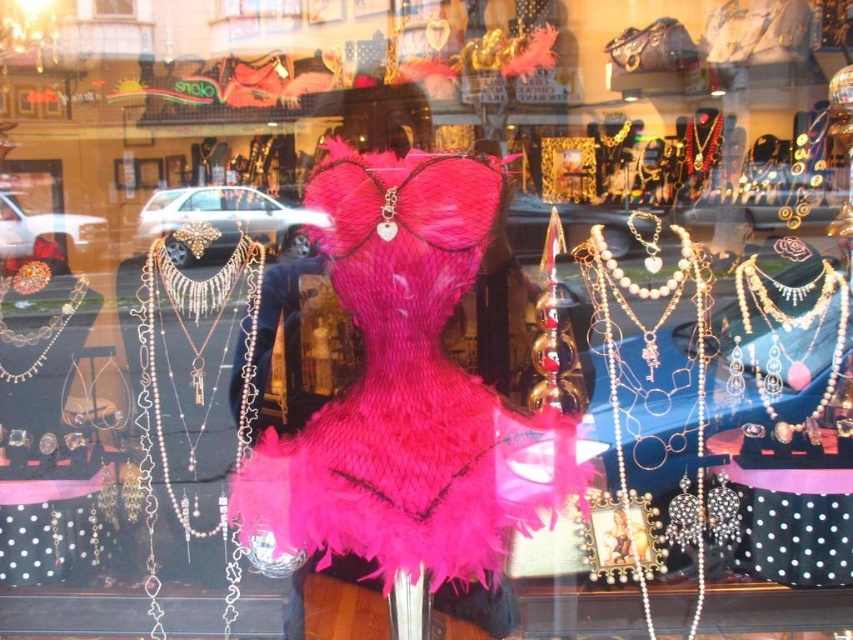
Looking at this image, you are a photographer standing 5 feet away from the camera. You want to take a photo of the fuzzy pink dress at center. Is the camera within your reach to adjust it?

The fuzzy pink dress at center and camera are 6.22 feet apart. Since you are standing 5 feet away from the camera, the distance between you and the camera is less than the 6.22 feet between the dress and the camera. Therefore, the camera is within your reach to adjust it.

You are a customer looking at the jewelry store display. You notice the fuzzy pink dress at center and the silver metallic chain at left. Which object appears taller in the display?

The fuzzy pink dress at center is much taller than the silver metallic chain at left, so the fuzzy pink dress at center appears taller.